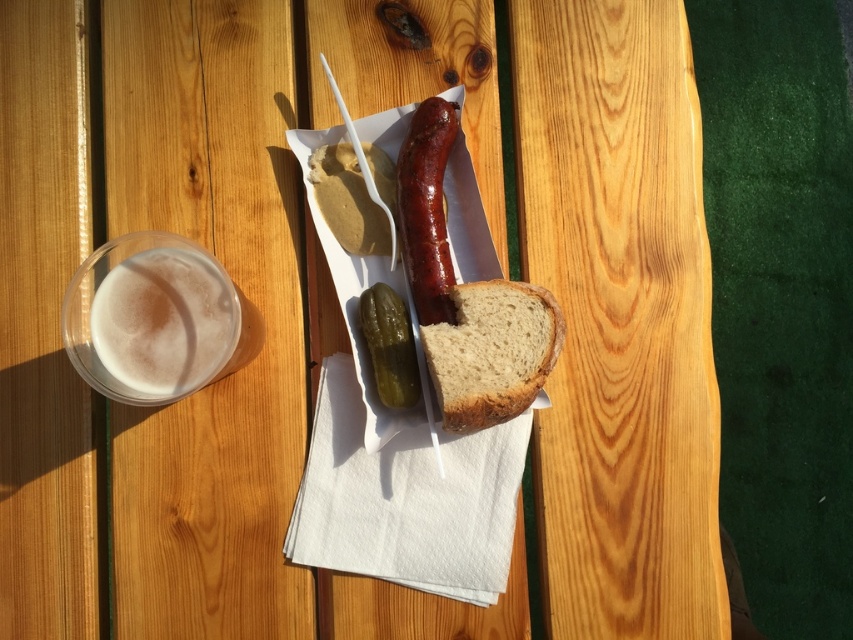
Between foamy plastic cup at left and shiny brown sausage at center, which one has more height?

shiny brown sausage at center

Between point (200, 296) and point (424, 268), which one is positioned in front?

Point (200, 296)

Does point (184, 332) lie behind point (433, 113)?

No, it is not.

Identify the location of foamy plastic cup at left. This screenshot has width=853, height=640. (163, 321).

Between foamy plastic cup at left and green pickled vegetable at center, which one has more height?

Standing taller between the two is foamy plastic cup at left.

This screenshot has height=640, width=853. What do you see at coordinates (163, 321) in the screenshot?
I see `foamy plastic cup at left` at bounding box center [163, 321].

Describe the element at coordinates (163, 321) in the screenshot. I see `foamy plastic cup at left` at that location.

Where is `foamy plastic cup at left`? foamy plastic cup at left is located at coordinates tap(163, 321).

Does brown crusty bread at center have a larger size compared to matte yellow mustard at center?

Indeed, brown crusty bread at center has a larger size compared to matte yellow mustard at center.

Between point (459, 336) and point (335, 221), which one is positioned in front?

Point (459, 336) is in front.

Between point (453, 396) and point (387, 189), which one is positioned behind?

The point (387, 189) is behind.

Find the location of `brown crusty bread at center`. brown crusty bread at center is located at coordinates (492, 353).